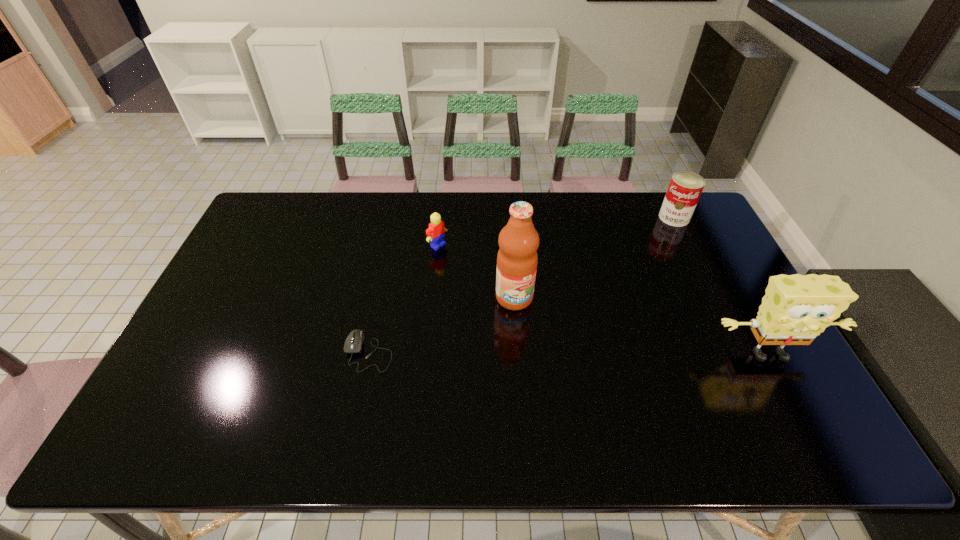
Identify the location of object situated at the far edge. The image size is (960, 540). (685, 188).

Identify the location of sponge present at the right edge. (796, 308).

At what (x,y) coordinates should I click in order to perform the action: click on can that is positioned at the right edge. Please return your answer as a coordinate pair (x, y). This screenshot has height=540, width=960. Looking at the image, I should click on (685, 188).

Find the location of a particular element. Image resolution: width=960 pixels, height=540 pixels. object present at the far right corner is located at coordinates (685, 188).

Find the location of a particular element. vacant region at the far edge of the desktop is located at coordinates click(x=508, y=205).

I want to click on vacant space at the near edge of the desktop, so click(x=664, y=385).

I want to click on free space at the left edge of the desktop, so click(x=188, y=348).

You are a GUI agent. You are given a task and a screenshot of the screen. Output one action in this format:
    pyautogui.click(x=<x>, y=<y>)
    Task: Click on the vacant space at the right edge of the desktop
    This screenshot has width=960, height=540.
    Given the screenshot: What is the action you would take?
    pyautogui.click(x=741, y=373)

You are a GUI agent. You are given a task and a screenshot of the screen. Output one action in this format:
    pyautogui.click(x=<x>, y=<y>)
    Task: Click on the free spot at the near right corner of the desktop
    This screenshot has height=540, width=960.
    Given the screenshot: What is the action you would take?
    pyautogui.click(x=761, y=384)

This screenshot has height=540, width=960. In order to click on free space between the third object from left to right and the sponge in this screenshot , I will do `click(641, 326)`.